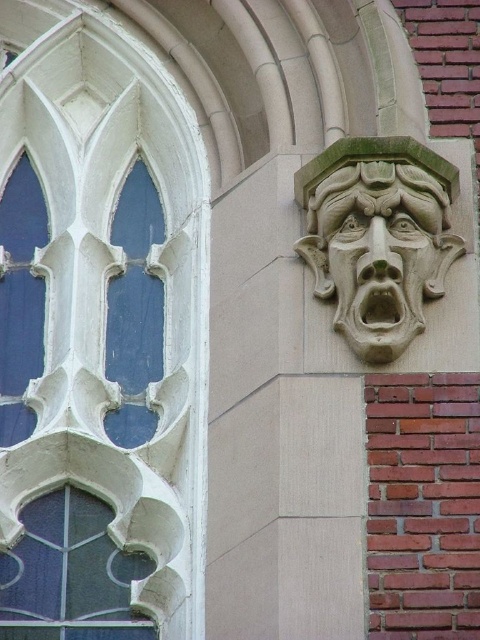
You are standing at the base of a Gothic Revival building and see the white stone window at upper left. If you want to reach the window, would you need to climb more than 200 feet of stairs?

The white stone window at upper left is 201.74 feet from viewer, so yes, you would need to climb more than 200 feet of stairs to reach it.